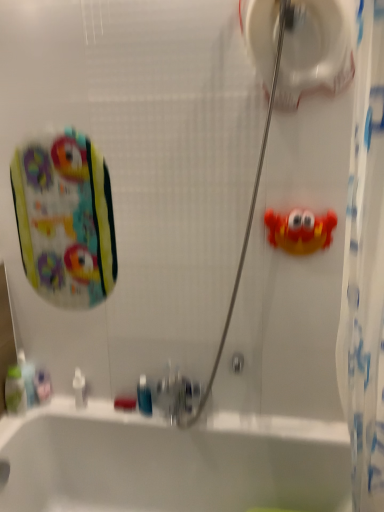
Measure the distance between rubber crab at right and camera.

The distance of rubber crab at right from camera is 4.48 feet.

Find the location of a particular element. rubber crab at right is located at coordinates (300, 230).

What do you see at coordinates (79, 388) in the screenshot? This screenshot has width=384, height=512. I see `white plastic bottle at lower left` at bounding box center [79, 388].

The image size is (384, 512). Describe the element at coordinates (42, 385) in the screenshot. I see `clear plastic mouthwash at lower left, marked as the 2th mouthwash in a right-to-left arrangement` at that location.

Describe the element at coordinates (316, 49) in the screenshot. Image resolution: width=384 pixels, height=512 pixels. I see `white glossy toilet paper at upper center` at that location.

Locate an element on the screen. Image resolution: width=384 pixels, height=512 pixels. white glossy bathtub at lower center is located at coordinates (170, 461).

Which is more distant, (68,404) or (27,368)?

The point (68,404) is farther from the camera.

Would you say white glossy bathtub at lower center is to the left or to the right of translucent plastic mouthwash at lower left, which is the 2th mouthwash from left to right, in the picture?

From the image, it's evident that white glossy bathtub at lower center is to the right of translucent plastic mouthwash at lower left, which is the 2th mouthwash from left to right.

Is white glossy bathtub at lower center wider or thinner than translucent plastic mouthwash at lower left, which is the 2th mouthwash from left to right?

In the image, white glossy bathtub at lower center appears to be wider than translucent plastic mouthwash at lower left, which is the 2th mouthwash from left to right.

From a real-world perspective, between white glossy bathtub at lower center and translucent plastic mouthwash at lower left, which is the 2th mouthwash from left to right, who is vertically higher?

In real-world perspective, translucent plastic mouthwash at lower left, which is the 2th mouthwash from left to right, is above.

Is white glossy toilet paper at upper center further to camera compared to translucent plastic mouthwash at lower left, which is the third mouthwash from right to left?

That is False.

Considering the points (259, 19) and (23, 365), which point is in front, point (259, 19) or point (23, 365)?

Point (259, 19)

Is white glossy toilet paper at upper center aimed at translucent plastic mouthwash at lower left, which is the third mouthwash from right to left?

No, white glossy toilet paper at upper center is not turned towards translucent plastic mouthwash at lower left, which is the third mouthwash from right to left.

Which is more to the right, white glossy toilet paper at upper center or translucent plastic mouthwash at lower left, which is the third mouthwash from right to left?

white glossy toilet paper at upper center.

Looking at this image, from the image's perspective, is translucent plastic mouthwash at lower left, which is the 2th mouthwash from left to right, under blue translucent mouthwash at lower center, positioned as the 1th mouthwash in right-to-left order?

Actually, translucent plastic mouthwash at lower left, which is the 2th mouthwash from left to right, appears above blue translucent mouthwash at lower center, positioned as the 1th mouthwash in right-to-left order, in the image.

Is translucent plastic mouthwash at lower left, which is the 2th mouthwash from left to right, smaller than blue translucent mouthwash at lower center, positioned as the 1th mouthwash in right-to-left order?

No.

In the scene shown: Can you see translucent plastic mouthwash at lower left, which is the 2th mouthwash from left to right, touching blue translucent mouthwash at lower center, positioned as the 1th mouthwash in right-to-left order?

No, translucent plastic mouthwash at lower left, which is the 2th mouthwash from left to right, is not with blue translucent mouthwash at lower center, positioned as the 1th mouthwash in right-to-left order.

Is clear plastic mouthwash at lower left, the third mouthwash positioned from the left, facing towards translucent plastic mouthwash at lower left, which is the 2th mouthwash from left to right?

No.

Considering the positions of objects clear plastic mouthwash at lower left, the third mouthwash positioned from the left, and translucent plastic mouthwash at lower left, which is the 2th mouthwash from left to right, in the image provided, who is more to the right, clear plastic mouthwash at lower left, the third mouthwash positioned from the left, or translucent plastic mouthwash at lower left, which is the 2th mouthwash from left to right,?

clear plastic mouthwash at lower left, the third mouthwash positioned from the left, is more to the right.

Is clear plastic mouthwash at lower left, the third mouthwash positioned from the left, taller than translucent plastic mouthwash at lower left, which is the third mouthwash from right to left?

In fact, clear plastic mouthwash at lower left, the third mouthwash positioned from the left, may be shorter than translucent plastic mouthwash at lower left, which is the third mouthwash from right to left.

The width and height of the screenshot is (384, 512). There is a white glossy toilet paper at upper center. What are the coordinates of `the 3rd mouthwash below it (from the image's perspective)` in the screenshot? It's located at (42, 385).

Does point (280, 99) come behind point (44, 386)?

No, (280, 99) is in front of (44, 386).

From a real-world perspective, is white glossy toilet paper at upper center physically located above or below clear plastic mouthwash at lower left, marked as the 2th mouthwash in a right-to-left arrangement?

From a real-world perspective, white glossy toilet paper at upper center is physically above clear plastic mouthwash at lower left, marked as the 2th mouthwash in a right-to-left arrangement.

Is white glossy toilet paper at upper center facing towards clear plastic mouthwash at lower left, the third mouthwash positioned from the left?

No, white glossy toilet paper at upper center is not turned towards clear plastic mouthwash at lower left, the third mouthwash positioned from the left.

Which of these two, white glossy bathtub at lower center or rubber crab at right, is wider?

white glossy bathtub at lower center.

Is rubber crab at right located within white glossy bathtub at lower center?

No, white glossy bathtub at lower center does not contain rubber crab at right.

Between white glossy bathtub at lower center and rubber crab at right, which one has less height?

rubber crab at right.

From the image's perspective, which one is positioned higher, blue translucent mouthwash at lower center, positioned as the 1th mouthwash in right-to-left order, or white plastic bottle at lower left?

white plastic bottle at lower left.

Relative to white plastic bottle at lower left, is blue translucent mouthwash at lower center, positioned as the 1th mouthwash in right-to-left order, in front or behind?

blue translucent mouthwash at lower center, positioned as the 1th mouthwash in right-to-left order, is positioned closer to the viewer than white plastic bottle at lower left.

Between blue translucent mouthwash at lower center, which is counted as the 4th mouthwash, starting from the left, and white plastic bottle at lower left, which one has larger width?

Wider between the two is blue translucent mouthwash at lower center, which is counted as the 4th mouthwash, starting from the left.

In the scene shown: Is blue translucent mouthwash at lower center, which is counted as the 4th mouthwash, starting from the left, positioned with its back to white plastic bottle at lower left?

No.

You are a GUI agent. You are given a task and a screenshot of the screen. Output one action in this format:
    pyautogui.click(x=<x>, y=<y>)
    Task: Click on the bathtub in front of the translucent plastic mouthwash at lower left, which is the third mouthwash from right to left
    The image size is (384, 512).
    Given the screenshot: What is the action you would take?
    pyautogui.click(x=170, y=461)

The width and height of the screenshot is (384, 512). What are the coordinates of `toilet paper above the translucent plastic mouthwash at lower left, which is the third mouthwash from right to left (from a real-world perspective)` in the screenshot? It's located at (316, 49).

Based on their spatial positions, is green plastic mouthwash at lower left, which is the 4th mouthwash in right-to-left order, or blue translucent mouthwash at lower center, which is counted as the 4th mouthwash, starting from the left, further from white glossy bathtub at lower center?

Based on the image, green plastic mouthwash at lower left, which is the 4th mouthwash in right-to-left order, appears to be further to white glossy bathtub at lower center.

Considering their positions, is white glossy toilet paper at upper center positioned closer to green plastic mouthwash at lower left, which is the 4th mouthwash in right-to-left order, than white glossy bathtub at lower center?

The object closer to green plastic mouthwash at lower left, which is the 4th mouthwash in right-to-left order, is white glossy bathtub at lower center.

Based on their spatial positions, is white glossy toilet paper at upper center or clear plastic mouthwash at lower left, the third mouthwash positioned from the left, further from green plastic mouthwash at lower left, which is the first mouthwash from left to right?

The object further to green plastic mouthwash at lower left, which is the first mouthwash from left to right, is white glossy toilet paper at upper center.

Which object lies nearer to the anchor point white plastic bottle at lower left, rubber crab at right or blue translucent mouthwash at lower center, which is counted as the 4th mouthwash, starting from the left?

blue translucent mouthwash at lower center, which is counted as the 4th mouthwash, starting from the left, lies closer to white plastic bottle at lower left than the other object.

When comparing their distances from white glossy bathtub at lower center, does blue translucent mouthwash at lower center, which is counted as the 4th mouthwash, starting from the left, or translucent plastic mouthwash at lower left, which is the 2th mouthwash from left to right, seem closer?

The object closer to white glossy bathtub at lower center is blue translucent mouthwash at lower center, which is counted as the 4th mouthwash, starting from the left.

From the image, which object appears to be nearer to white glossy bathtub at lower center, rubber crab at right or clear plastic mouthwash at lower left, the third mouthwash positioned from the left?

Among the two, clear plastic mouthwash at lower left, the third mouthwash positioned from the left, is located nearer to white glossy bathtub at lower center.

Which object lies nearer to the anchor point rubber crab at right, blue translucent mouthwash at lower center, positioned as the 1th mouthwash in right-to-left order, or white plastic bottle at lower left?

blue translucent mouthwash at lower center, positioned as the 1th mouthwash in right-to-left order, is positioned closer to the anchor rubber crab at right.

Looking at this image, which object lies nearer to the anchor point blue translucent mouthwash at lower center, positioned as the 1th mouthwash in right-to-left order, white plastic bottle at lower left or white glossy toilet paper at upper center?

The object closer to blue translucent mouthwash at lower center, positioned as the 1th mouthwash in right-to-left order, is white plastic bottle at lower left.

This screenshot has width=384, height=512. I want to click on toilet paper between green plastic mouthwash at lower left, which is the 4th mouthwash in right-to-left order, and rubber crab at right, so click(x=316, y=49).

This screenshot has width=384, height=512. I want to click on toiletry located between white glossy bathtub at lower center and clear plastic mouthwash at lower left, marked as the 2th mouthwash in a right-to-left arrangement, in the depth direction, so click(x=79, y=388).

You are a GUI agent. You are given a task and a screenshot of the screen. Output one action in this format:
    pyautogui.click(x=<x>, y=<y>)
    Task: Click on the toiletry between white glossy toilet paper at upper center and blue translucent mouthwash at lower center, positioned as the 1th mouthwash in right-to-left order, vertically
    This screenshot has height=512, width=384.
    Given the screenshot: What is the action you would take?
    pyautogui.click(x=79, y=388)

Where is `toiletry situated between green plastic mouthwash at lower left, which is the 4th mouthwash in right-to-left order, and blue translucent mouthwash at lower center, which is counted as the 4th mouthwash, starting from the left, from left to right`? This screenshot has width=384, height=512. toiletry situated between green plastic mouthwash at lower left, which is the 4th mouthwash in right-to-left order, and blue translucent mouthwash at lower center, which is counted as the 4th mouthwash, starting from the left, from left to right is located at coordinates (79, 388).